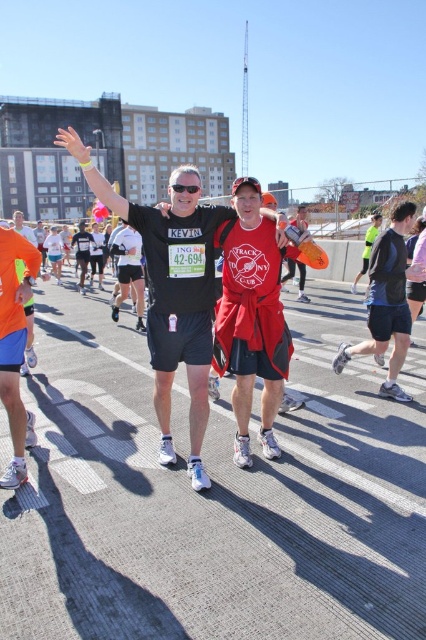
Question: Which point is closer to the camera?

Choices:
 (A) (282, 282)
 (B) (396, 228)

Answer: (B)

Question: Can you confirm if matte black t-shirt at center is positioned to the right of red fabric jacket at center?

Choices:
 (A) no
 (B) yes

Answer: (A)

Question: Can you confirm if black matte shorts at right is bigger than red fabric jacket at center?

Choices:
 (A) no
 (B) yes

Answer: (A)

Question: Does matte black t-shirt at center appear on the right side of red fabric jacket at center?

Choices:
 (A) yes
 (B) no

Answer: (B)

Question: Which point appears closest to the camera in this image?

Choices:
 (A) (399, 346)
 (B) (154, 246)

Answer: (B)

Question: Which point appears farthest from the camera in this image?

Choices:
 (A) (193, 320)
 (B) (370, 230)
 (C) (296, 218)

Answer: (B)